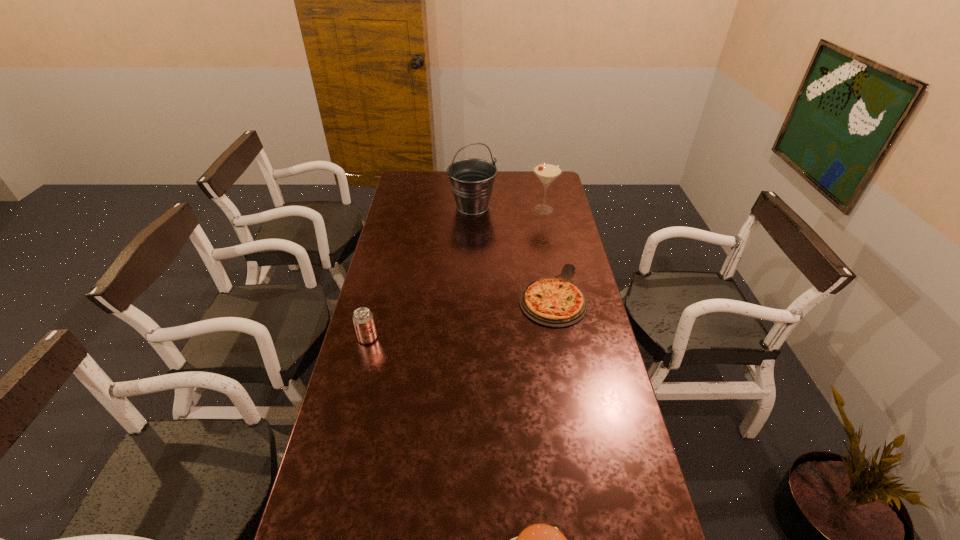
At what (x,y) coordinates should I click in order to perform the action: click on bucket. Please return your answer as a coordinate pair (x, y). Looking at the image, I should click on (472, 180).

You are a GUI agent. You are given a task and a screenshot of the screen. Output one action in this format:
    pyautogui.click(x=<x>, y=<y>)
    Task: Click on the second tallest object
    The width and height of the screenshot is (960, 540).
    Given the screenshot: What is the action you would take?
    pyautogui.click(x=547, y=172)

You are a GUI agent. You are given a task and a screenshot of the screen. Output one action in this format:
    pyautogui.click(x=<x>, y=<y>)
    Task: Click on the fourth farthest object
    This screenshot has width=960, height=540.
    Given the screenshot: What is the action you would take?
    pyautogui.click(x=363, y=320)

Find the location of a particular element. beer can is located at coordinates (363, 320).

Identify the location of the shortest object. This screenshot has width=960, height=540. (556, 302).

In order to click on pizza in this screenshot , I will do `click(556, 302)`.

Where is `vacant space situated on the front of the tallest object`? This screenshot has width=960, height=540. vacant space situated on the front of the tallest object is located at coordinates (471, 274).

In order to click on free space located on the front of the fourth shortest object in this screenshot , I will do `click(547, 228)`.

Find the location of a particular element. vacant region located on the right of the third shortest object is located at coordinates (470, 338).

What are the coordinates of `free spot located on the left of the pizza` in the screenshot? It's located at (492, 294).